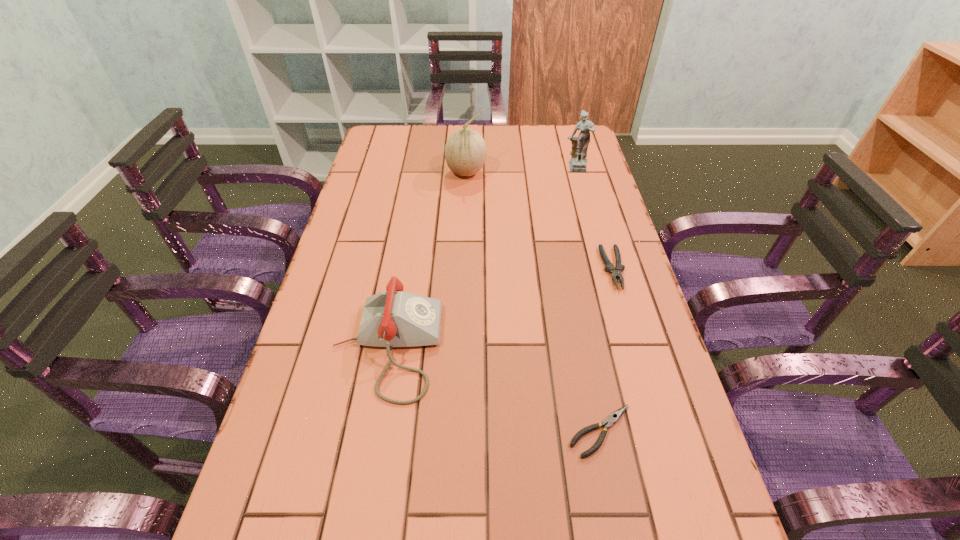
Find the location of a particular element. This screenshot has width=960, height=540. figurine is located at coordinates (578, 161).

Locate an element on the screen. The width and height of the screenshot is (960, 540). cantaloup is located at coordinates (465, 151).

At what (x,y) coordinates should I click in order to perform the action: click on telephone. Please return your answer as a coordinate pair (x, y). The width and height of the screenshot is (960, 540). Looking at the image, I should click on (393, 318).

This screenshot has width=960, height=540. What are the coordinates of `the third nearest object` in the screenshot? It's located at (615, 272).

Locate an element on the screen. The height and width of the screenshot is (540, 960). the fourth tallest object is located at coordinates (615, 272).

What are the coordinates of `the nearer pliers` in the screenshot? It's located at pyautogui.click(x=610, y=420).

Where is `the left pliers`? the left pliers is located at coordinates (610, 420).

Locate an element on the screen. The width and height of the screenshot is (960, 540). free region located on the front-facing side of the figurine is located at coordinates (596, 246).

Where is `free spot located 0.320m on the right of the cantaloup`? This screenshot has height=540, width=960. free spot located 0.320m on the right of the cantaloup is located at coordinates (583, 173).

Locate an element on the screen. The height and width of the screenshot is (540, 960). vacant region located 0.300m on the dial of the telephone is located at coordinates (575, 347).